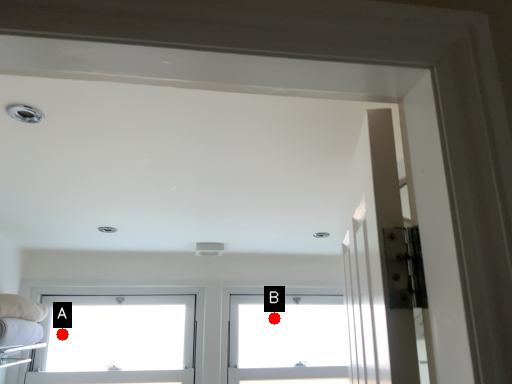
Question: Two points are circled on the image, labeled by A and B beside each circle. Which point is closer to the camera?

Choices:
 (A) A is closer
 (B) B is closer

Answer: (A)